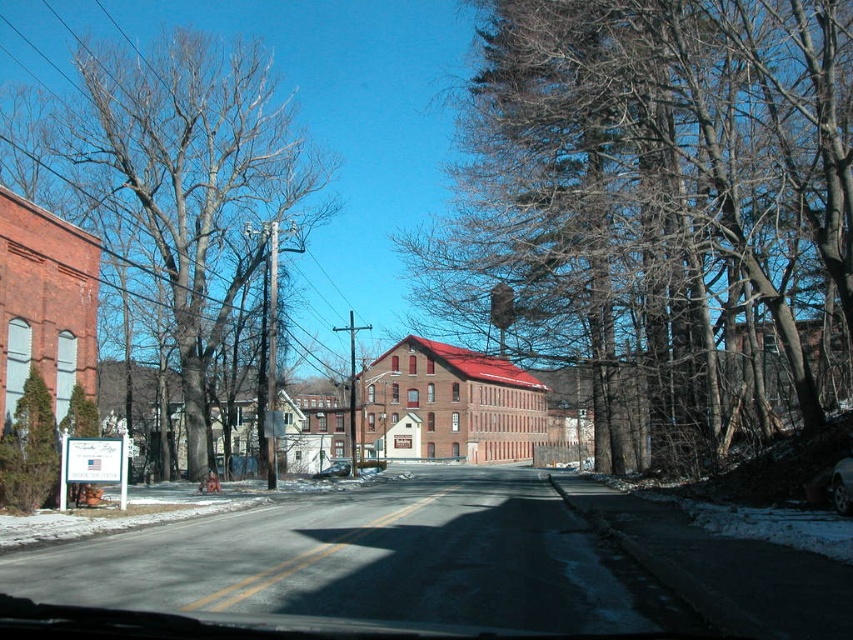
You are a photographer trying to capture the shiny black car at center and the brown bark tree at left in a single frame. Based on their sizes, which object should you focus on first to ensure both fit in the shot?

The brown bark tree at left is wider than the shiny black car at center, so you should focus on positioning the camera to include the wider brown bark tree at left first to ensure both objects fit in the frame.

You are standing on the sidewalk looking at the street scene. There are two points marked on the road ahead of you. The first point is at coordinates point (792, 364) and the second point is at point (834, 492). Which point is closer to your current position?

Point (792, 364) is further to the camera than point (834, 492), so the point closer to your current position is point (834, 492).